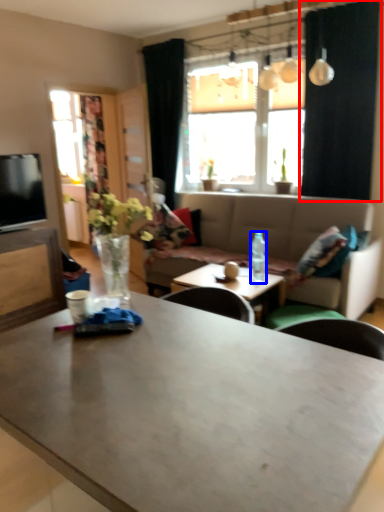
Question: Which of the following is the closest to the observer, curtain (highlighted by a red box) or bottle (highlighted by a blue box)?

Choices:
 (A) curtain
 (B) bottle

Answer: (B)